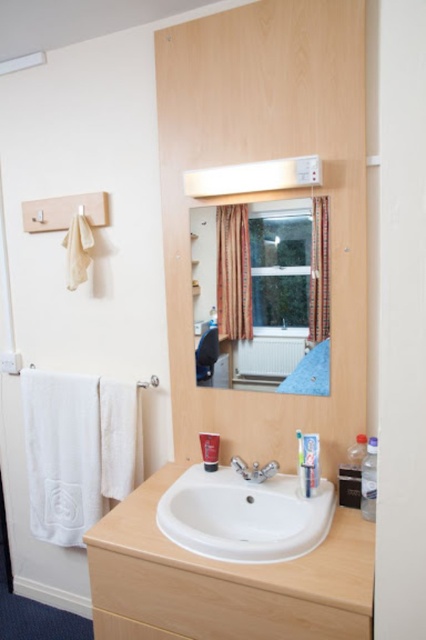
Question: Can you confirm if brown textured curtain at center is positioned above silver metallic faucet at center?

Choices:
 (A) no
 (B) yes

Answer: (B)

Question: Based on their relative distances, which object is nearer to the white matte toothpaste at center?

Choices:
 (A) clear glass window at center
 (B) matte glass mirror at upper center
 (C) silver metallic towel bar at upper left

Answer: (B)

Question: Which object appears farthest from the camera in this image?

Choices:
 (A) matte plastic toothpaste tube at sink
 (B) white matte toothpaste at center
 (C) silver metallic faucet at center

Answer: (A)

Question: Is the position of white ceramic sink at center more distant than that of plaid fabric curtain at upper center?

Choices:
 (A) yes
 (B) no

Answer: (B)

Question: Can you confirm if white matte toothpaste at center is wider than matte plastic toothpaste tube at sink?

Choices:
 (A) no
 (B) yes

Answer: (A)

Question: Which point is farther from the camera taking this photo?

Choices:
 (A) (259, 308)
 (B) (316, 484)
 (C) (250, 273)

Answer: (C)